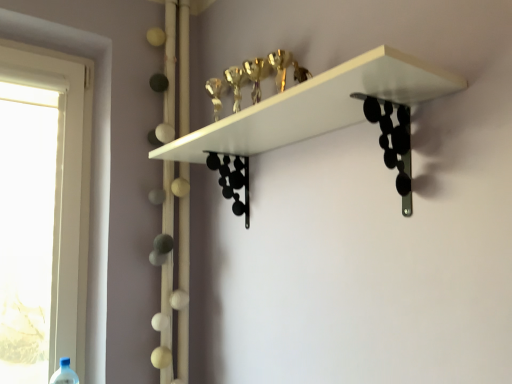
Question: Is white matte shelf at upper center to the left of blue plastic bottle at lower left from the viewer's perspective?

Choices:
 (A) yes
 (B) no

Answer: (B)

Question: From a real-world perspective, is white matte shelf at upper center over blue plastic bottle at lower left?

Choices:
 (A) no
 (B) yes

Answer: (B)

Question: Would you say blue plastic bottle at lower left is part of white matte shelf at upper center's contents?

Choices:
 (A) no
 (B) yes

Answer: (A)

Question: Is white matte shelf at upper center at the right side of blue plastic bottle at lower left?

Choices:
 (A) yes
 (B) no

Answer: (A)

Question: Would you say white matte shelf at upper center is outside blue plastic bottle at lower left?

Choices:
 (A) no
 (B) yes

Answer: (B)

Question: Does white matte shelf at upper center have a lesser width compared to blue plastic bottle at lower left?

Choices:
 (A) no
 (B) yes

Answer: (A)

Question: Would you say blue plastic bottle at lower left is outside white matte shelf at upper center?

Choices:
 (A) no
 (B) yes

Answer: (B)

Question: From a real-world perspective, is blue plastic bottle at lower left under white matte shelf at upper center?

Choices:
 (A) yes
 (B) no

Answer: (A)

Question: Can you confirm if blue plastic bottle at lower left is positioned to the left of white matte shelf at upper center?

Choices:
 (A) yes
 (B) no

Answer: (A)

Question: Is blue plastic bottle at lower left wider than white matte shelf at upper center?

Choices:
 (A) no
 (B) yes

Answer: (A)

Question: From the image's perspective, is blue plastic bottle at lower left below white matte shelf at upper center?

Choices:
 (A) yes
 (B) no

Answer: (A)

Question: Could you tell me if blue plastic bottle at lower left is facing white matte shelf at upper center?

Choices:
 (A) yes
 (B) no

Answer: (B)

Question: In terms of width, does blue plastic bottle at lower left look wider or thinner when compared to white matte shelf at upper center?

Choices:
 (A) thin
 (B) wide

Answer: (A)